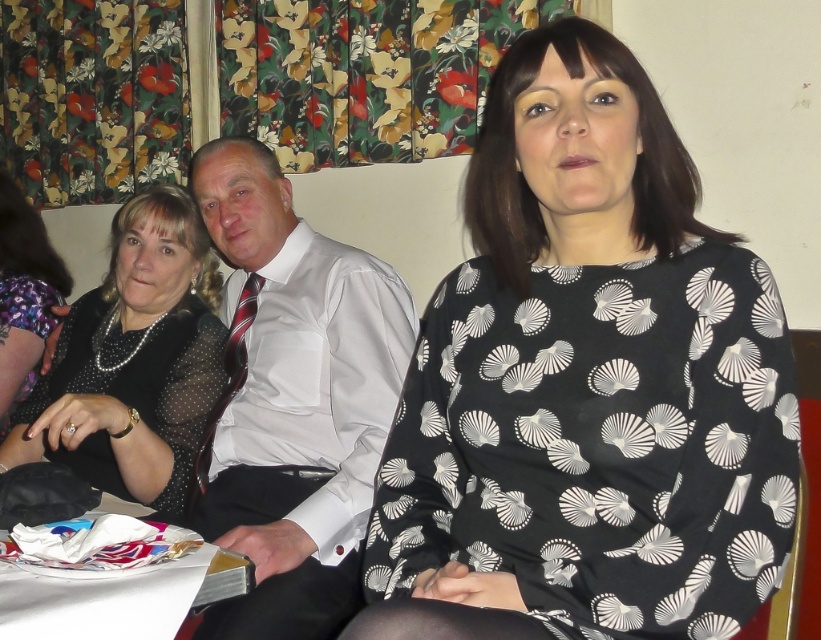
You are a photographer standing at the back of the room. You want to take a photo of the black printed blouse at center and ensure both individuals are in focus. The camera you are using has a depth of field that can cover 35 inches. Will both individuals be in focus?

The individuals are 35.11 inches apart. Since the depth of field can cover 35 inches, the distance between them slightly exceeds the camera setting. Therefore, both individuals may not be entirely in focus.

You are a photographer setting up for a group photo. You want to ensure that both the white satin shirt at center and the black sheer dress at left are fully visible in the frame. Based on their positions, which one might block the other if you don t adjust the camera angle?

The white satin shirt at center is in front of the black sheer dress at left, so it might block the black sheer dress at left if the camera angle isn t adjusted.

Which object is located at the coordinates point (585, 385)?

The black printed blouse at center is located at point (585, 385).